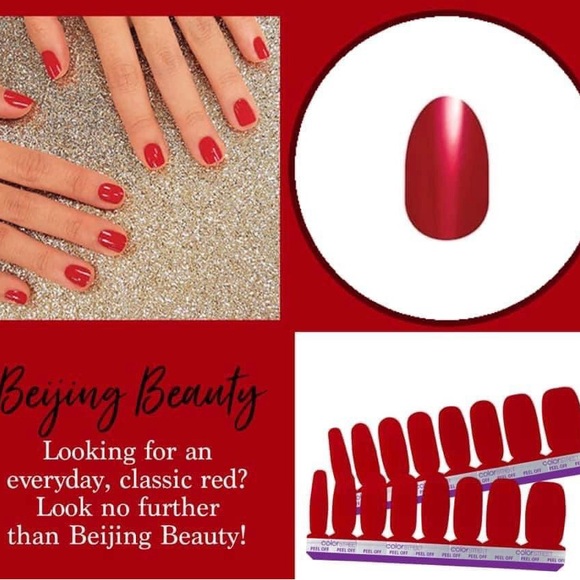
At what (x,y) coordinates should I click in order to perform the action: click on countertop. Please return your answer as a coordinate pair (x, y). The height and width of the screenshot is (580, 580). Looking at the image, I should click on (211, 239).